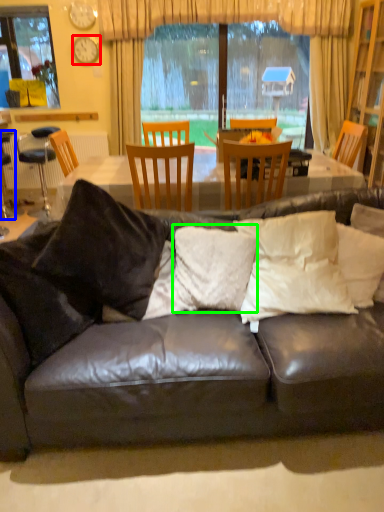
Question: Estimate the real-world distances between objects in this image. Which object is farther from clock (highlighted by a red box), bar stool (highlighted by a blue box) or pillow (highlighted by a green box)?

Choices:
 (A) bar stool
 (B) pillow

Answer: (B)